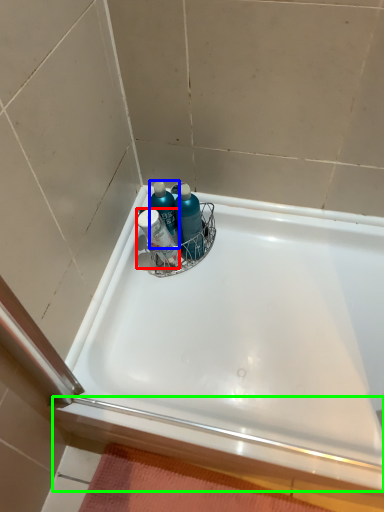
Question: Which object is the farthest from mouthwash (highlighted by a red box)? Choose among these: cleaning product (highlighted by a blue box) or ledge (highlighted by a green box).

Choices:
 (A) cleaning product
 (B) ledge

Answer: (B)